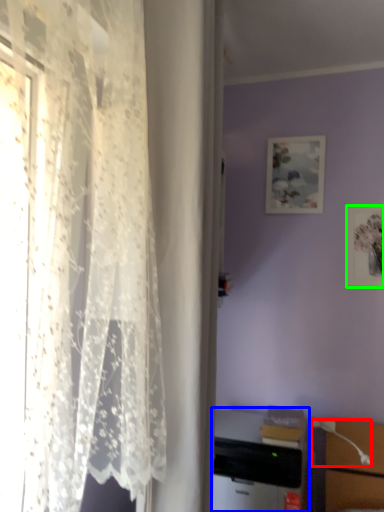
Question: Which is nearer to the table lamp (highlighted by a red box)? desktop computer (highlighted by a blue box) or picture frame (highlighted by a green box).

Choices:
 (A) desktop computer
 (B) picture frame

Answer: (A)